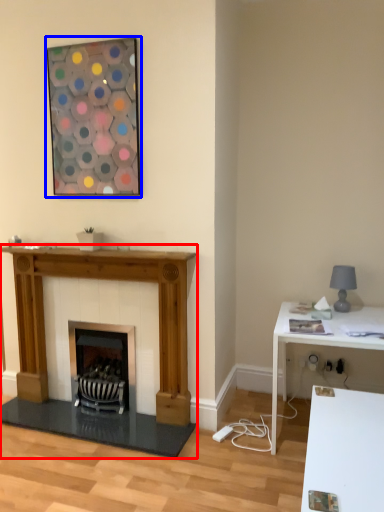
Question: Which point is closer to the camera, fireplace (highlighted by a red box) or picture frame (highlighted by a blue box)?

Choices:
 (A) fireplace
 (B) picture frame

Answer: (B)